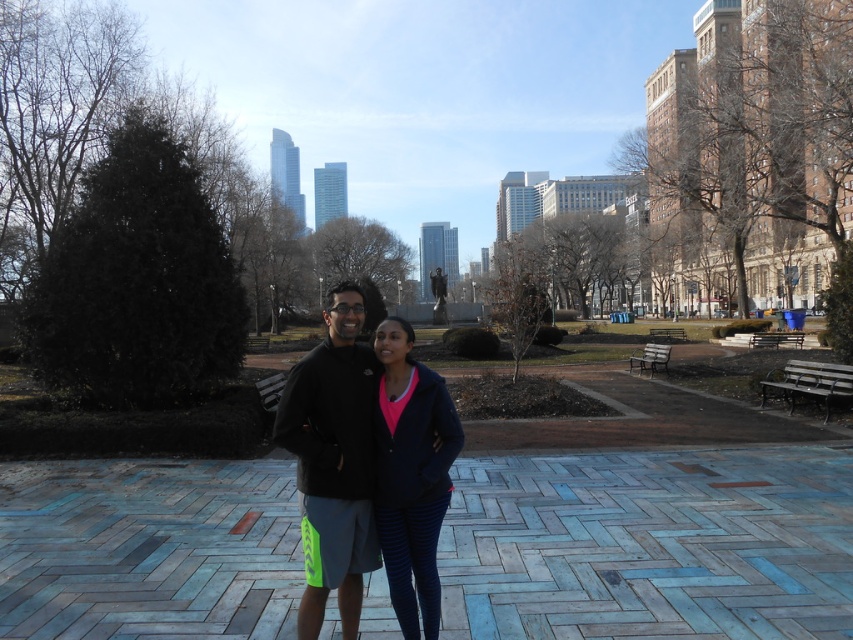
You are a photographer trying to capture both the dark blue fleece at center and the matte blue leggings at center in the same frame. Based on their positions and sizes, do you think you can fit both into your camera viewfinder without moving your position?

The dark blue fleece at center might be wider than matte blue leggings at center, so there is a possibility that both can be captured in the same frame depending on the viewfinder size and their exact positioning.

You are an observer in the park and want to determine which of the two items at the center is bigger. You see the dark blue fleece at center and the matte blue leggings at center. Which one is larger?

The dark blue fleece at center is larger in size than the matte blue leggings at center.

You are a photographer trying to capture the statue in the background of the park scene. You notice a point at coordinates (334,458) in the image. Based on the scene description, where is this point located?

The point at coordinates (334,458) is located on the dark blue fleece at center, which is part of the statue or its base in the park scene.